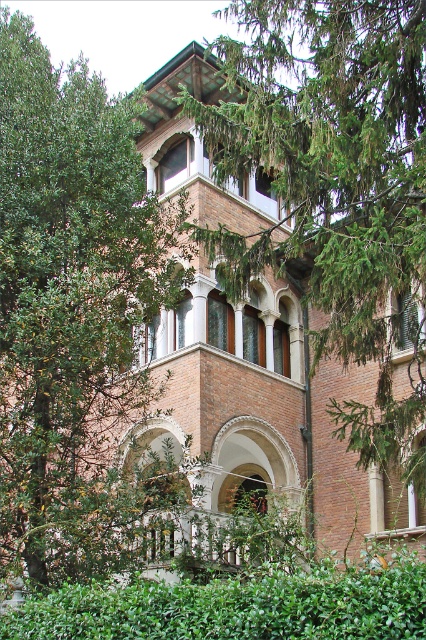
Question: Can you confirm if green leafy hedge at lower center is wider than matte brick archway at center?

Choices:
 (A) no
 (B) yes

Answer: (B)

Question: Which of the following is the farthest from the observer?

Choices:
 (A) green leafy tree at left
 (B) green leafy hedge at lower center
 (C) green leafy tree at center

Answer: (C)

Question: Is green leafy tree at left further to camera compared to green leafy tree at center?

Choices:
 (A) yes
 (B) no

Answer: (B)

Question: Based on their relative distances, which object is farther from the green leafy tree at left?

Choices:
 (A) matte brick archway at center
 (B) green leafy tree at center
 (C) green leafy hedge at lower center

Answer: (A)

Question: Is green leafy tree at center to the right of matte brick archway at center from the viewer's perspective?

Choices:
 (A) no
 (B) yes

Answer: (B)

Question: Among these objects, which one is farthest from the camera?

Choices:
 (A) green leafy tree at center
 (B) green leafy hedge at lower center

Answer: (A)